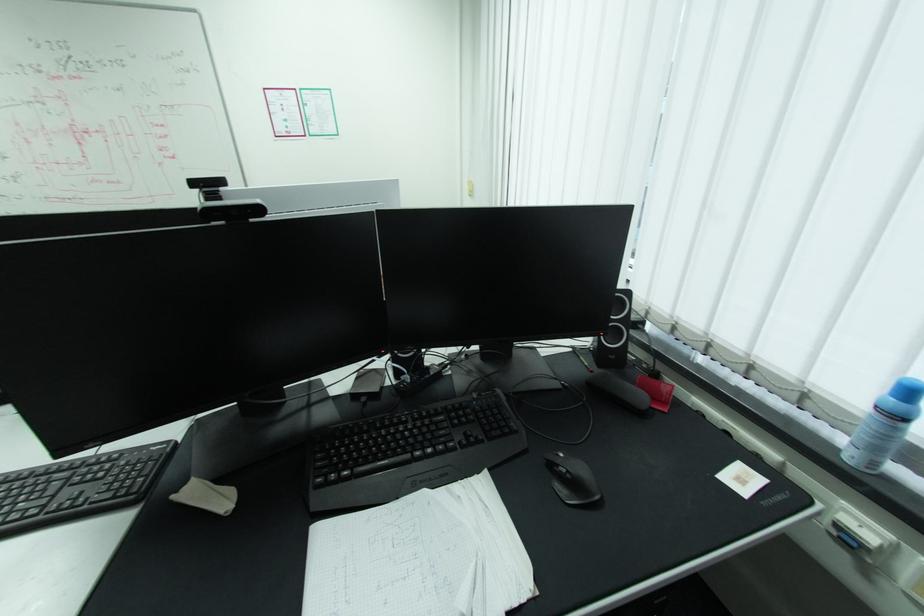
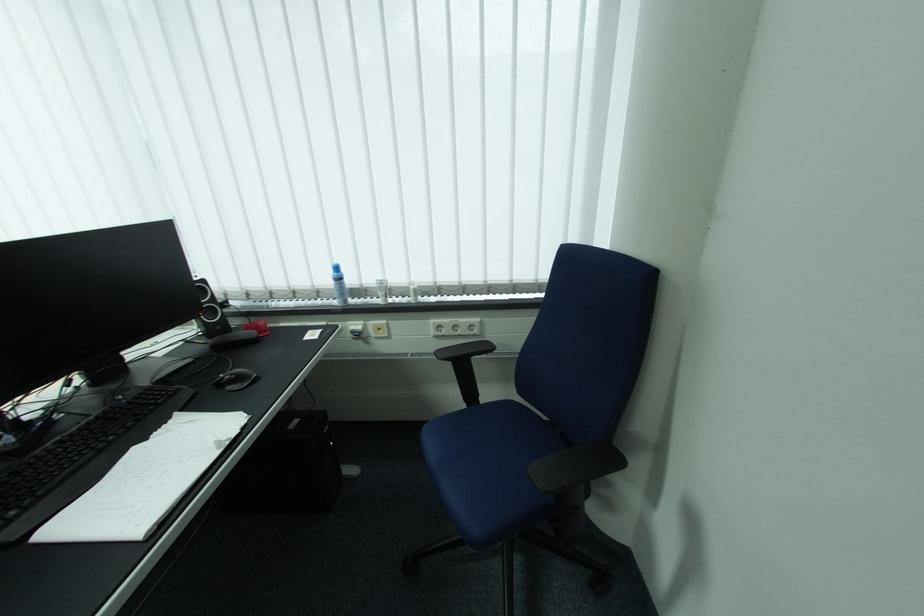
Locate, in the second image, the point that corresponds to (x=580, y=484) in the first image.

(245, 379)